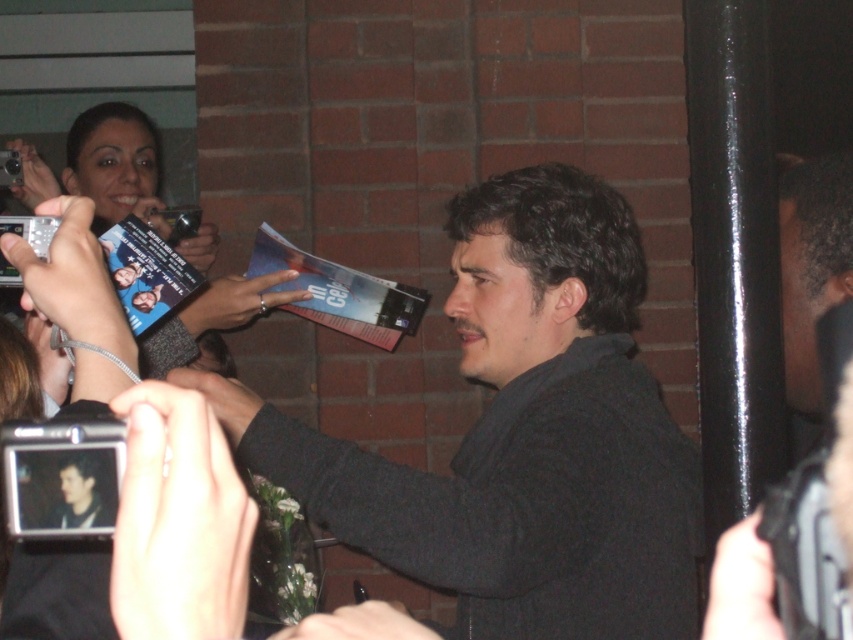
You are a photographer at the event and want to take a photo of the man in the dark gray sweater at center without the matte black camera at upper left appearing in the frame. Given their relative heights, which object should you position lower in your shot?

Since the dark gray sweater at center is taller than the matte black camera at upper left, you should position the matte black camera at upper left lower in your shot to avoid it appearing in the frame.

You are a photographer at the event and need to adjust your matte black camera at upper left to capture the dark gray sweater at center clearly. Based on their positions, should you move the camera closer or farther away?

The dark gray sweater at center is closer to the viewer than the matte black camera at upper left, so to capture it clearly, you should move the matte black camera at upper left closer to the subject.

You are a photographer at the event and need to determine if the dark gray sweater at center can fit into the frame of the matte black camera at upper left. Based on their widths, will it fit?

The dark gray sweater at center has a lesser width compared to the matte black camera at upper left, so it can fit into the camera frame.